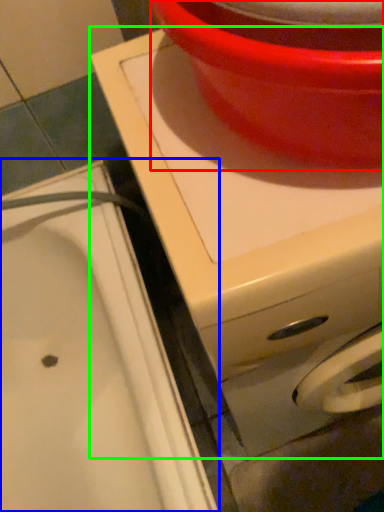
Question: Which object is the closest to the basin (highlighted by a red box)? Choose among these: sink (highlighted by a blue box) or appliance (highlighted by a green box).

Choices:
 (A) sink
 (B) appliance

Answer: (B)